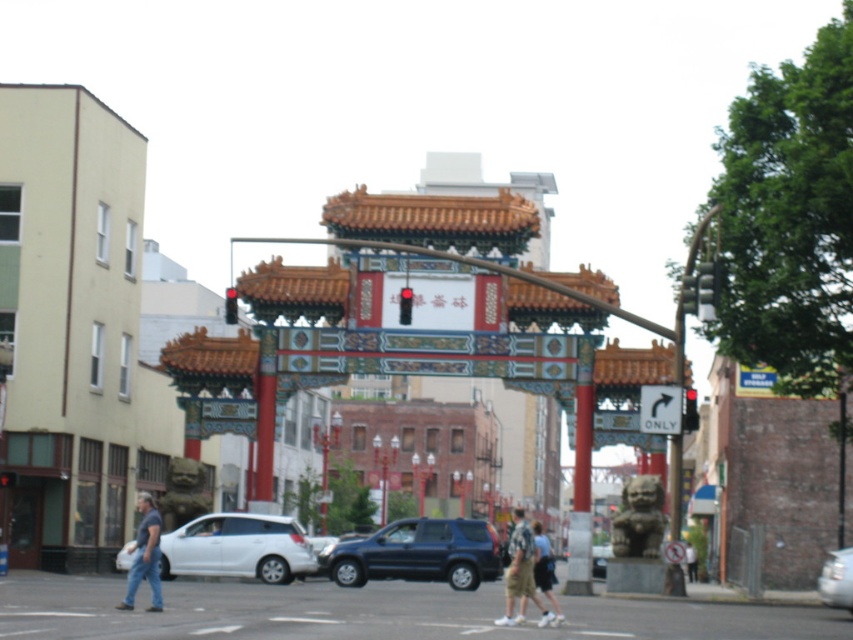
Question: Can you confirm if black glass door at lower left is wider than black plastic arrow at center?

Choices:
 (A) yes
 (B) no

Answer: (A)

Question: Is matte black suv at center wider than silver metallic car at center?

Choices:
 (A) no
 (B) yes

Answer: (B)

Question: Which point is closer to the camera taking this photo?

Choices:
 (A) (834, 552)
 (B) (520, 513)
 (C) (364, 566)

Answer: (C)

Question: Does silver metallic car at center appear on the right side of light brown shorts at center?

Choices:
 (A) yes
 (B) no

Answer: (A)

Question: Which object is the closest to the white matte car at center?

Choices:
 (A) silver metallic car at center
 (B) matte black suv at center

Answer: (B)

Question: Which object is positioned farthest from the denim pants at lower left?

Choices:
 (A) camouflage shirt at center
 (B) light brown shorts at center

Answer: (A)